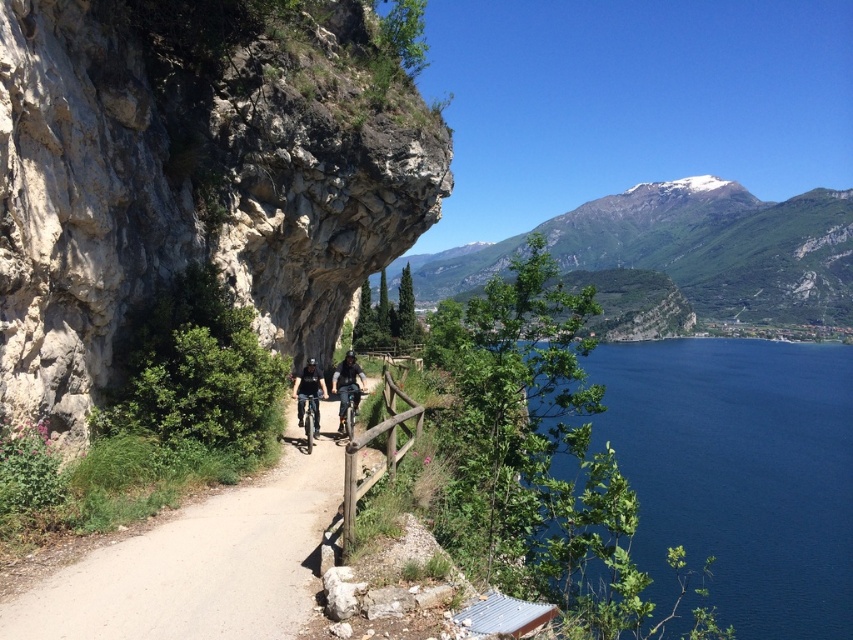
Between deep blue water at lower right and dirt path at center, which one appears on the right side from the viewer's perspective?

deep blue water at lower right

Between deep blue water at lower right and dirt path at center, which one is positioned higher?

dirt path at center is above.

This screenshot has width=853, height=640. Describe the element at coordinates (738, 474) in the screenshot. I see `deep blue water at lower right` at that location.

Locate an element on the screen. The image size is (853, 640). deep blue water at lower right is located at coordinates (738, 474).

Which is below, deep blue water at lower right or dark blue fabric jacket at center?

Positioned lower is deep blue water at lower right.

Between deep blue water at lower right and dark blue fabric jacket at center, which one appears on the right side from the viewer's perspective?

Positioned to the right is deep blue water at lower right.

Is point (775, 628) positioned behind point (344, 406)?

Yes.

Locate an element on the screen. deep blue water at lower right is located at coordinates (738, 474).

Does rugged stone cliff at left have a lesser width compared to green rocky mountain at upper right?

Yes.

This screenshot has width=853, height=640. Describe the element at coordinates (189, 193) in the screenshot. I see `rugged stone cliff at left` at that location.

Locate an element on the screen. rugged stone cliff at left is located at coordinates [189, 193].